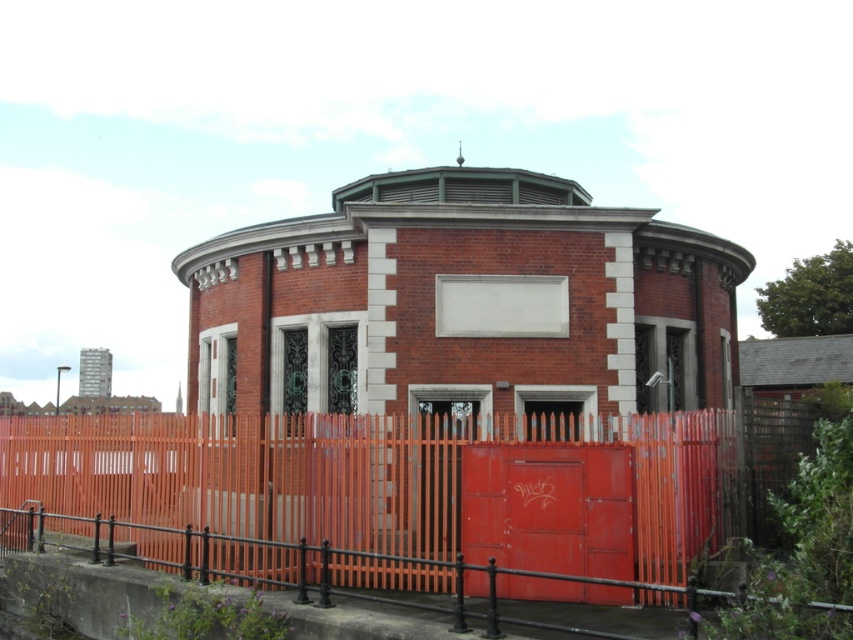
Question: Which point is farther to the camera?

Choices:
 (A) metallic red door at center
 (B) orange wooden fence at lower left

Answer: (A)

Question: Which point is closer to the camera taking this photo?

Choices:
 (A) (352, 580)
 (B) (608, 508)

Answer: (B)

Question: Observing the image, what is the correct spatial positioning of orange wooden fence at lower left in reference to metallic red door at center?

Choices:
 (A) below
 (B) above

Answer: (B)

Question: Can you confirm if orange wooden fence at lower left is positioned to the right of metallic red door at center?

Choices:
 (A) yes
 (B) no

Answer: (B)

Question: Is orange wooden fence at lower left bigger than metallic red door at center?

Choices:
 (A) yes
 (B) no

Answer: (A)

Question: Which object is closer to the camera taking this photo?

Choices:
 (A) orange wooden fence at lower left
 (B) metallic red door at center

Answer: (A)